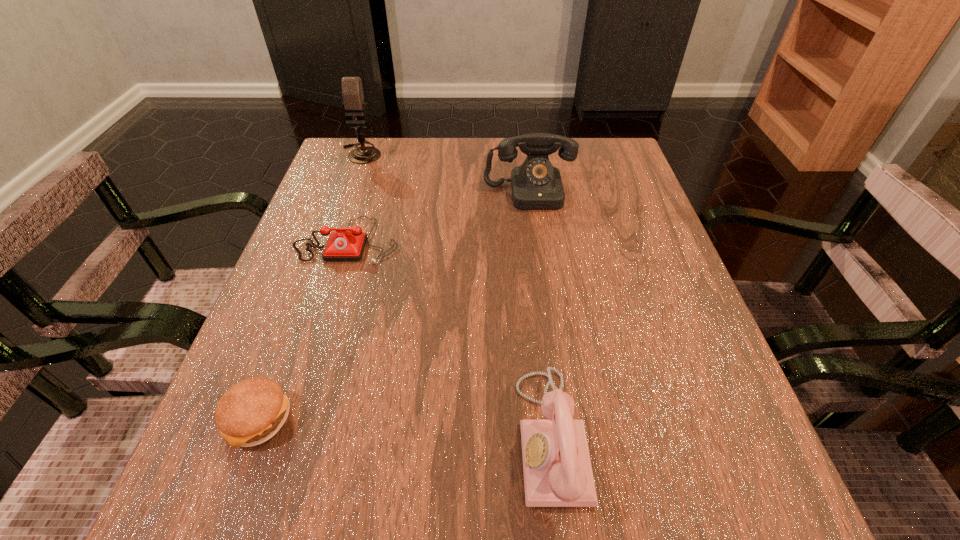
Locate which object ranks fourth in proximity to the third shortest object. Please provide its 2D coordinates. Your answer should be formatted as a tuple, i.e. [(x, y)], where the tuple contains the x and y coordinates of a point satisfying the conditions above.

[(352, 91)]

Identify which telephone is the second nearest to the tallest object. Please provide its 2D coordinates. Your answer should be formatted as a tuple, i.e. [(x, y)], where the tuple contains the x and y coordinates of a point satisfying the conditions above.

[(536, 185)]

Locate which telephone is the second closest to the hamburger. Please provide its 2D coordinates. Your answer should be formatted as a tuple, i.e. [(x, y)], where the tuple contains the x and y coordinates of a point satisfying the conditions above.

[(557, 467)]

In order to click on free space in the image that satisfies the following two spatial constraints: 1. on the dial of the farthest telephone; 2. on the dial of the nearest telephone in this screenshot , I will do `click(562, 436)`.

The height and width of the screenshot is (540, 960). Identify the location of free point that satisfies the following two spatial constraints: 1. on the dial of the second farthest object; 2. on the dial of the third tallest object. (562, 436).